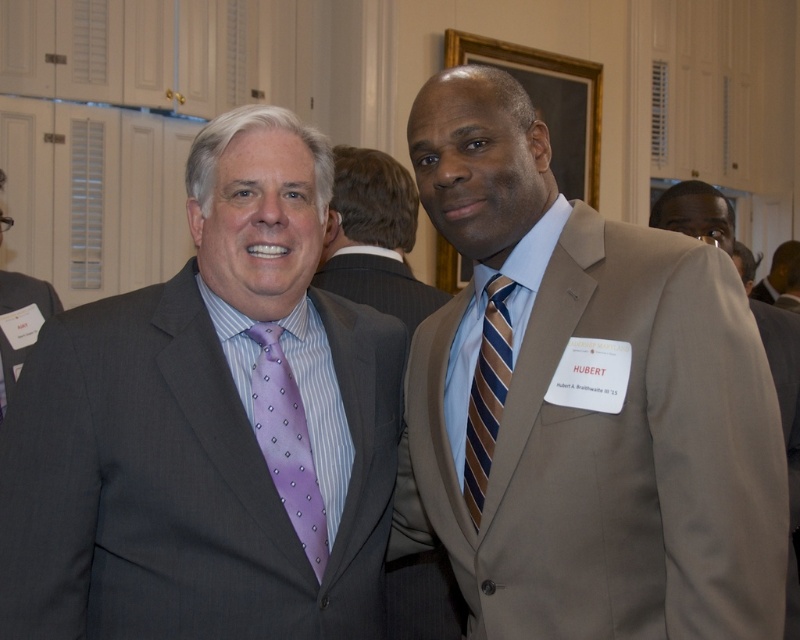
Question: Which point appears closest to the camera in this image?

Choices:
 (A) (18, 280)
 (B) (698, 227)
 (C) (774, 272)

Answer: (B)

Question: Observing the image, what is the correct spatial positioning of matte beige suit at center in reference to matte black suit at left?

Choices:
 (A) above
 (B) below

Answer: (B)

Question: Does matte beige suit at center come in front of light brown suit at center?

Choices:
 (A) yes
 (B) no

Answer: (A)

Question: Does matte gray suit at left have a greater width compared to matte gray suit at center?

Choices:
 (A) yes
 (B) no

Answer: (A)

Question: Among these points, which one is farthest from the camera?

Choices:
 (A) (200, 406)
 (B) (464, 67)

Answer: (B)

Question: Which point is closer to the camera?

Choices:
 (A) matte gray suit at center
 (B) matte beige suit at center
 (C) light brown suit at center
 (D) purple dotted silk tie at center

Answer: (B)